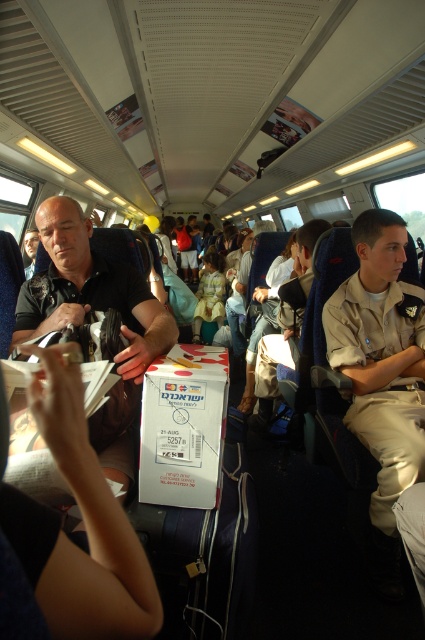
You are a passenger on a train and need to place a small backpack between the khaki uniform at right and the matte black shirt at left. Based on their heights, which object should the backpack be placed closer to?

The khaki uniform at right is taller than the matte black shirt at left, so the backpack should be placed closer to the khaki uniform at right to ensure stability.

Consider the image. You are a passenger in the train carriage and want to find the khaki uniform at right. According to the scene description, where would you look to find it?

The khaki uniform at right is located at point 0.559 on the x axis and 0.899 on the y axis.

You are a passenger on the train and want to take a photo of the khaki uniform at right and the matte black shirt at left. Which one should you focus on first to ensure it is in the foreground of your photo?

You should focus on the khaki uniform at right first because it is closer to you than the matte black shirt at left, making it the foreground object.